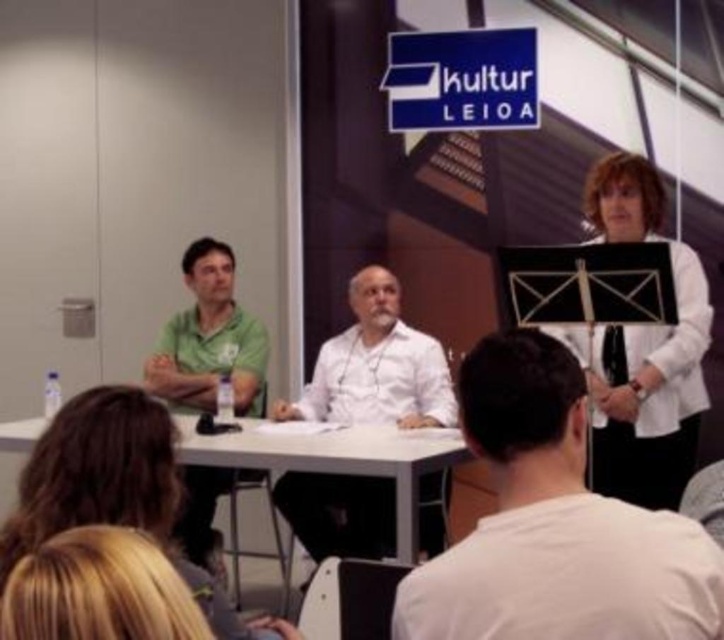
Question: Does white cotton shirt at center come in front of white plastic table at center?

Choices:
 (A) yes
 (B) no

Answer: (A)

Question: Is white matte jacket at right in front of white matte shirt at center?

Choices:
 (A) yes
 (B) no

Answer: (A)

Question: Which point is farther to the camera?

Choices:
 (A) white plastic table at center
 (B) green matte shirt at left
 (C) white matte jacket at right

Answer: (B)

Question: Which object is farther from the camera taking this photo?

Choices:
 (A) white matte shirt at center
 (B) white cotton shirt at center
 (C) green matte shirt at left

Answer: (C)

Question: Is green matte shirt at left wider than white plastic table at center?

Choices:
 (A) yes
 (B) no

Answer: (B)

Question: Which point is closer to the camera taking this photo?

Choices:
 (A) (476, 449)
 (B) (209, 388)

Answer: (A)